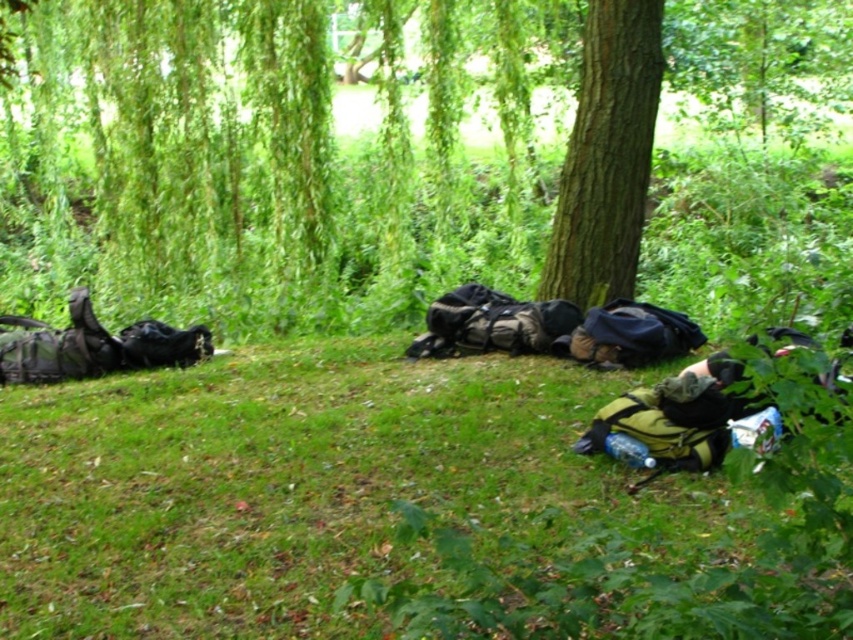
Between green grass at lower left and brown rough bark tree at center, which one is positioned lower?

Positioned lower is green grass at lower left.

Does green grass at lower left lie in front of brown rough bark tree at center?

Yes, green grass at lower left is closer to the viewer.

What do you see at coordinates (354, 506) in the screenshot? The height and width of the screenshot is (640, 853). I see `green grass at lower left` at bounding box center [354, 506].

Find the location of a particular element. Image resolution: width=853 pixels, height=640 pixels. green grass at lower left is located at coordinates (354, 506).